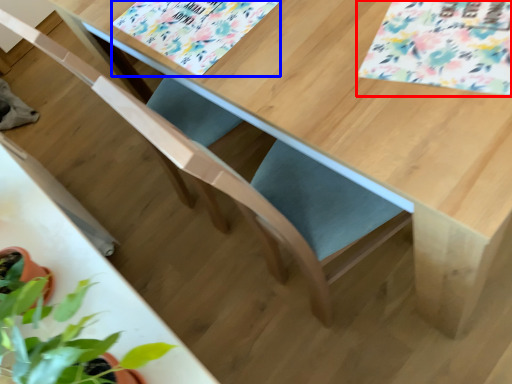
Question: Which object appears closest to the camera in this image, flower (highlighted by a red box) or flower (highlighted by a blue box)?

Choices:
 (A) flower
 (B) flower

Answer: (A)